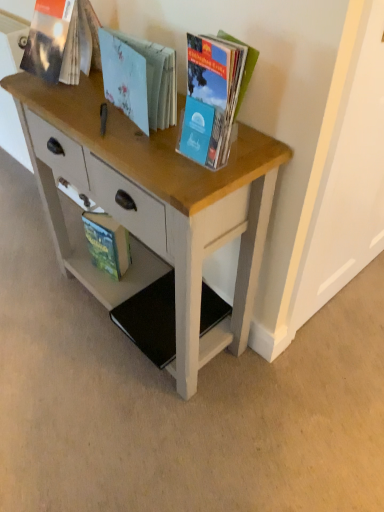
Question: Considering the relative sizes of green matte book at lower left, placed as the 1th book when sorted from back to front, and matte paper book at upper left, positioned as the second book in back-to-front order, in the image provided, is green matte book at lower left, placed as the 1th book when sorted from back to front, bigger than matte paper book at upper left, positioned as the second book in back-to-front order,?

Choices:
 (A) yes
 (B) no

Answer: (B)

Question: Would you say green matte book at lower left, the 4th book in the front-to-back sequence, is outside matte paper book at upper left, positioned as the second book in back-to-front order?

Choices:
 (A) no
 (B) yes

Answer: (B)

Question: Is green matte book at lower left, the 4th book in the front-to-back sequence, shorter than matte paper book at upper left, positioned as the second book in back-to-front order?

Choices:
 (A) yes
 (B) no

Answer: (B)

Question: Is green matte book at lower left, placed as the 1th book when sorted from back to front, looking in the opposite direction of matte paper book at upper left, marked as the third book in a front-to-back arrangement?

Choices:
 (A) yes
 (B) no

Answer: (B)

Question: Is green matte book at lower left, the 4th book in the front-to-back sequence, at the left side of matte paper book at upper left, positioned as the second book in back-to-front order?

Choices:
 (A) no
 (B) yes

Answer: (A)

Question: Does green matte book at lower left, placed as the 1th book when sorted from back to front, come behind matte paper book at upper left, marked as the third book in a front-to-back arrangement?

Choices:
 (A) no
 (B) yes

Answer: (B)

Question: Considering the relative sizes of matte plastic book at upper right, the fourth book from the back, and matte paper book at upper left, marked as the third book in a front-to-back arrangement, in the image provided, is matte plastic book at upper right, the fourth book from the back, bigger than matte paper book at upper left, marked as the third book in a front-to-back arrangement,?

Choices:
 (A) no
 (B) yes

Answer: (A)

Question: Is matte plastic book at upper right, the fourth book from the back, further to the viewer compared to matte paper book at upper left, positioned as the second book in back-to-front order?

Choices:
 (A) yes
 (B) no

Answer: (B)

Question: Would you say matte paper book at upper left, marked as the third book in a front-to-back arrangement, is part of matte plastic book at upper right, the first book in the front-to-back sequence,'s contents?

Choices:
 (A) yes
 (B) no

Answer: (B)

Question: From a real-world perspective, is matte plastic book at upper right, the fourth book from the back, physically below matte paper book at upper left, marked as the third book in a front-to-back arrangement?

Choices:
 (A) no
 (B) yes

Answer: (A)

Question: From a real-world perspective, is matte plastic book at upper right, the fourth book from the back, positioned over matte paper book at upper left, positioned as the second book in back-to-front order, based on gravity?

Choices:
 (A) no
 (B) yes

Answer: (B)

Question: Is matte plastic book at upper right, the fourth book from the back, closer to the viewer compared to matte paper book at upper left, marked as the third book in a front-to-back arrangement?

Choices:
 (A) no
 (B) yes

Answer: (B)

Question: Does wooden desk at center have a larger size compared to matte plastic book at upper right, the fourth book from the back?

Choices:
 (A) no
 (B) yes

Answer: (B)